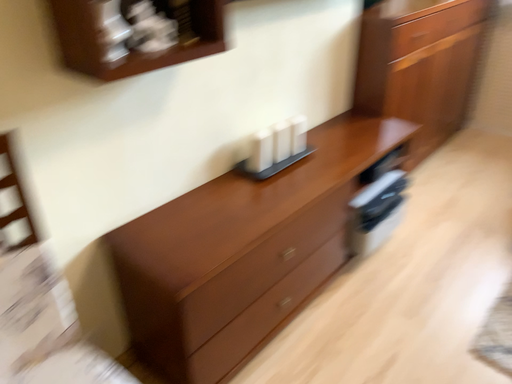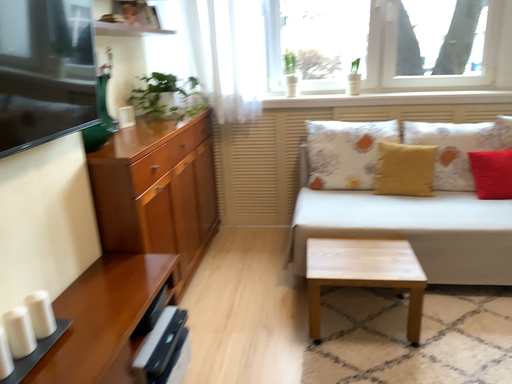
Question: How did the camera likely rotate when shooting the video?

Choices:
 (A) rotated right
 (B) rotated left

Answer: (A)